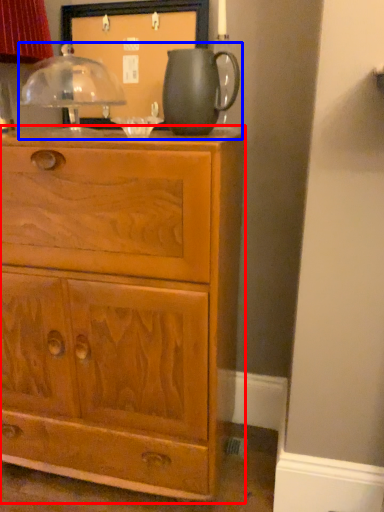
Question: Which object appears farthest to the camera in this image, chest of drawers (highlighted by a red box) or tea set (highlighted by a blue box)?

Choices:
 (A) chest of drawers
 (B) tea set

Answer: (B)